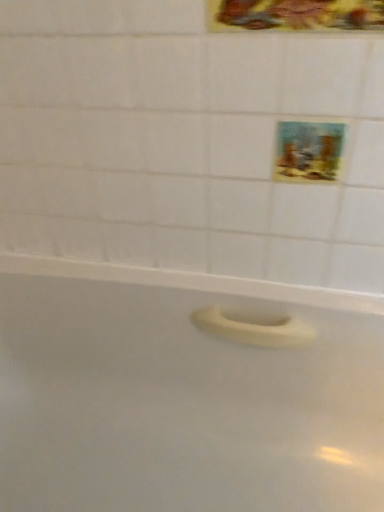
This screenshot has width=384, height=512. What do you see at coordinates (185, 391) in the screenshot?
I see `white matte bathtub at center` at bounding box center [185, 391].

The image size is (384, 512). What do you see at coordinates (308, 151) in the screenshot?
I see `pastel painted picture at upper right, the 1th decorative picture positioned from the bottom` at bounding box center [308, 151].

Describe the element at coordinates (295, 15) in the screenshot. This screenshot has width=384, height=512. I see `metallic gold frame at upper center, the 2th decorative picture ordered from the bottom` at that location.

Identify the location of metallic gold frame at upper center, the first decorative picture positioned from the front. (295, 15).

You are a GUI agent. You are given a task and a screenshot of the screen. Output one action in this format:
    pyautogui.click(x=<x>, y=<y>)
    Task: Click on the white matte bathtub at center
    
    Given the screenshot: What is the action you would take?
    pyautogui.click(x=185, y=391)

From a real-world perspective, is metallic gold frame at upper center, the 2th decorative picture ordered from the bottom, positioned under white matte bathtub at center based on gravity?

Incorrect, from a real-world perspective, metallic gold frame at upper center, the 2th decorative picture ordered from the bottom, is higher than white matte bathtub at center.

Considering the points (211, 9) and (81, 426), which point is in front, point (211, 9) or point (81, 426)?

The point (211, 9) is closer to the camera.

Could you measure the distance between metallic gold frame at upper center, the 2th decorative picture ordered from the bottom, and white matte bathtub at center?

67.40 centimeters.

From the image's perspective, is metallic gold frame at upper center, arranged as the first decorative picture when viewed from the top, over white matte bathtub at center?

Yes.

Is white matte bathtub at center spatially inside pastel painted picture at upper right, positioned as the second decorative picture in front-to-back order, or outside of it?

white matte bathtub at center lies outside pastel painted picture at upper right, positioned as the second decorative picture in front-to-back order.

Are white matte bathtub at center and pastel painted picture at upper right, placed as the first decorative picture when sorted from back to front, beside each other?

No, white matte bathtub at center is not touching pastel painted picture at upper right, placed as the first decorative picture when sorted from back to front.

Is white matte bathtub at center oriented towards pastel painted picture at upper right, positioned as the second decorative picture in front-to-back order?

No, white matte bathtub at center is not facing towards pastel painted picture at upper right, positioned as the second decorative picture in front-to-back order.

Considering the positions of objects white matte bathtub at center and pastel painted picture at upper right, placed as the first decorative picture when sorted from back to front, in the image provided, who is in front, white matte bathtub at center or pastel painted picture at upper right, placed as the first decorative picture when sorted from back to front,?

white matte bathtub at center is more forward.

Is metallic gold frame at upper center, marked as the 2th decorative picture in a back-to-front arrangement, facing away from pastel painted picture at upper right, the 1th decorative picture positioned from the bottom?

No, metallic gold frame at upper center, marked as the 2th decorative picture in a back-to-front arrangement, is not facing the opposite direction of pastel painted picture at upper right, the 1th decorative picture positioned from the bottom.

Is point (319, 27) positioned in front of point (282, 139)?

That is True.

From a real-world perspective, does metallic gold frame at upper center, arranged as the first decorative picture when viewed from the top, sit lower than pastel painted picture at upper right, positioned as the second decorative picture in front-to-back order?

No, from a real-world perspective, metallic gold frame at upper center, arranged as the first decorative picture when viewed from the top, is not beneath pastel painted picture at upper right, positioned as the second decorative picture in front-to-back order.

How many degrees apart are the facing directions of metallic gold frame at upper center, the first decorative picture positioned from the front, and pastel painted picture at upper right, positioned as the second decorative picture in front-to-back order?

The angular difference between metallic gold frame at upper center, the first decorative picture positioned from the front, and pastel painted picture at upper right, positioned as the second decorative picture in front-to-back order, is 0 degrees.

From the image's perspective, which one is positioned higher, pastel painted picture at upper right, placed as the first decorative picture when sorted from back to front, or white matte bathtub at center?

From the image's view, pastel painted picture at upper right, placed as the first decorative picture when sorted from back to front, is above.

You are a GUI agent. You are given a task and a screenshot of the screen. Output one action in this format:
    pyautogui.click(x=<x>, y=<y>)
    Task: Click on the bathtub located on the left of pastel painted picture at upper right, positioned as the second decorative picture in front-to-back order
    The width and height of the screenshot is (384, 512).
    Given the screenshot: What is the action you would take?
    pyautogui.click(x=185, y=391)

Which is farther from the camera, [290,164] or [184,315]?

The point [184,315] is farther from the camera.

In terms of width, does pastel painted picture at upper right, placed as the first decorative picture when sorted from back to front, look wider or thinner when compared to white matte bathtub at center?

pastel painted picture at upper right, placed as the first decorative picture when sorted from back to front, is thinner than white matte bathtub at center.

Which point is more forward, (351, 411) or (266, 3)?

The point (266, 3) is closer.

From a real-world perspective, is white matte bathtub at center positioned above or below metallic gold frame at upper center, marked as the 2th decorative picture in a back-to-front arrangement?

white matte bathtub at center is situated lower than metallic gold frame at upper center, marked as the 2th decorative picture in a back-to-front arrangement, in the real world.

Is white matte bathtub at center not close to metallic gold frame at upper center, marked as the 2th decorative picture in a back-to-front arrangement?

white matte bathtub at center is actually quite close to metallic gold frame at upper center, marked as the 2th decorative picture in a back-to-front arrangement.

Is white matte bathtub at center to the right of metallic gold frame at upper center, arranged as the first decorative picture when viewed from the top, from the viewer's perspective?

No.

Considering the relative sizes of pastel painted picture at upper right, the 1th decorative picture positioned from the bottom, and metallic gold frame at upper center, the 2th decorative picture ordered from the bottom, in the image provided, is pastel painted picture at upper right, the 1th decorative picture positioned from the bottom, bigger than metallic gold frame at upper center, the 2th decorative picture ordered from the bottom,?

Incorrect, pastel painted picture at upper right, the 1th decorative picture positioned from the bottom, is not larger than metallic gold frame at upper center, the 2th decorative picture ordered from the bottom.

From a real-world perspective, who is located lower, pastel painted picture at upper right, the 1th decorative picture positioned from the bottom, or metallic gold frame at upper center, marked as the 2th decorative picture in a back-to-front arrangement?

pastel painted picture at upper right, the 1th decorative picture positioned from the bottom.

Based on the photo, is pastel painted picture at upper right, positioned as the second decorative picture in front-to-back order, positioned beyond the bounds of metallic gold frame at upper center, the 2th decorative picture ordered from the bottom?

Absolutely, pastel painted picture at upper right, positioned as the second decorative picture in front-to-back order, is external to metallic gold frame at upper center, the 2th decorative picture ordered from the bottom.

Is point (323, 158) closer or farther from the camera than point (259, 12)?

Clearly, point (323, 158) is more distant from the camera than point (259, 12).

This screenshot has height=512, width=384. I want to click on bathtub in front of the metallic gold frame at upper center, the first decorative picture positioned from the front, so click(x=185, y=391).

In the image, there is a pastel painted picture at upper right, placed as the first decorative picture when sorted from back to front. Where is `bathtub below it (from a real-world perspective)`? bathtub below it (from a real-world perspective) is located at coordinates (185, 391).

Estimate the real-world distances between objects in this image. Which object is further from pastel painted picture at upper right, positioned as the second decorative picture in front-to-back order, white matte bathtub at center or metallic gold frame at upper center, marked as the 2th decorative picture in a back-to-front arrangement?

white matte bathtub at center is further to pastel painted picture at upper right, positioned as the second decorative picture in front-to-back order.

In the scene shown: Looking at the image, which one is located further to white matte bathtub at center, metallic gold frame at upper center, the first decorative picture positioned from the front, or pastel painted picture at upper right, placed as the first decorative picture when sorted from back to front?

metallic gold frame at upper center, the first decorative picture positioned from the front, lies further to white matte bathtub at center than the other object.

Based on their spatial positions, is white matte bathtub at center or pastel painted picture at upper right, placed as the first decorative picture when sorted from back to front, further from metallic gold frame at upper center, arranged as the first decorative picture when viewed from the top?

white matte bathtub at center is further to metallic gold frame at upper center, arranged as the first decorative picture when viewed from the top.

Looking at the image, which one is located further to white matte bathtub at center, pastel painted picture at upper right, placed as the second decorative picture when sorted from top to bottom, or metallic gold frame at upper center, arranged as the first decorative picture when viewed from the top?

Among the two, metallic gold frame at upper center, arranged as the first decorative picture when viewed from the top, is located further to white matte bathtub at center.

Considering their positions, is pastel painted picture at upper right, positioned as the second decorative picture in front-to-back order, positioned further to metallic gold frame at upper center, the 2th decorative picture ordered from the bottom, than white matte bathtub at center?

white matte bathtub at center is further to metallic gold frame at upper center, the 2th decorative picture ordered from the bottom.

Which object lies nearer to the anchor point pastel painted picture at upper right, the 1th decorative picture positioned from the bottom, metallic gold frame at upper center, arranged as the first decorative picture when viewed from the top, or white matte bathtub at center?

metallic gold frame at upper center, arranged as the first decorative picture when viewed from the top, lies closer to pastel painted picture at upper right, the 1th decorative picture positioned from the bottom, than the other object.

Where is `decorative picture between metallic gold frame at upper center, the 2th decorative picture ordered from the bottom, and white matte bathtub at center, in the vertical direction`? decorative picture between metallic gold frame at upper center, the 2th decorative picture ordered from the bottom, and white matte bathtub at center, in the vertical direction is located at coordinates (308, 151).